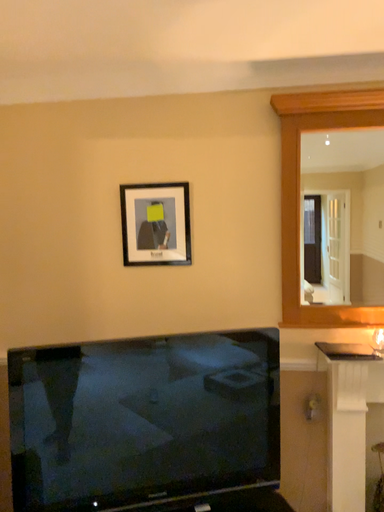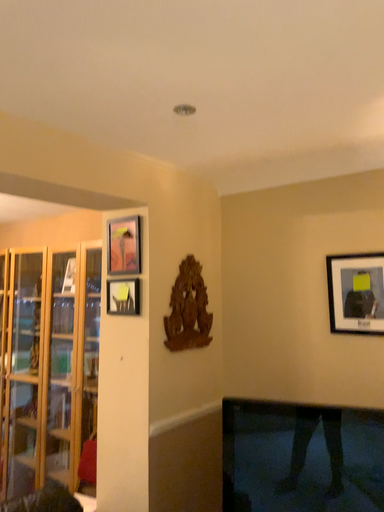
Question: How did the camera likely rotate when shooting the video?

Choices:
 (A) rotated right
 (B) rotated left

Answer: (B)